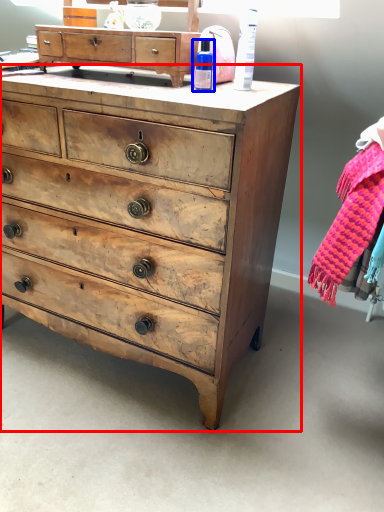
Question: Which object appears farthest to the camera in this image, chest of drawers (highlighted by a red box) or toiletry (highlighted by a blue box)?

Choices:
 (A) chest of drawers
 (B) toiletry

Answer: (B)